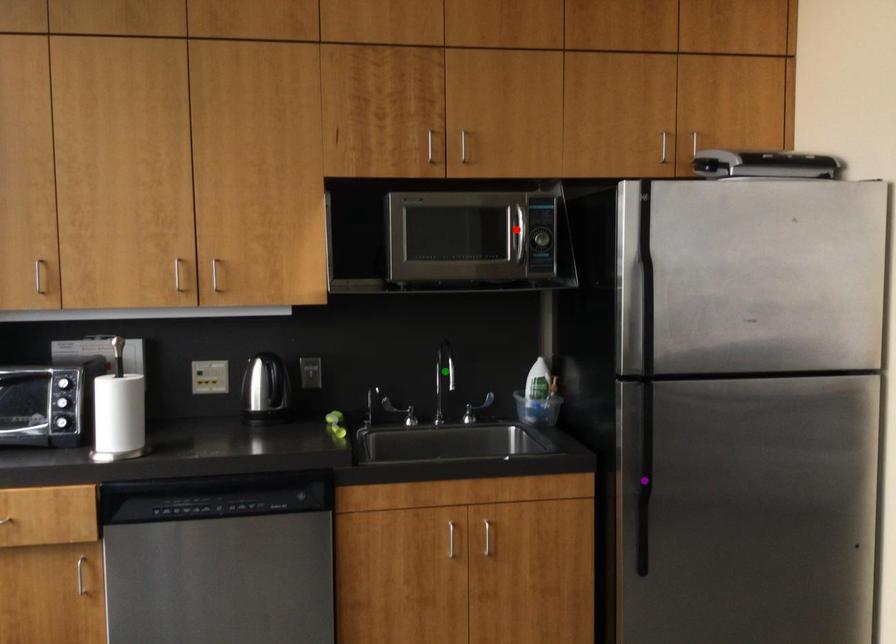
Order these from nearest to farthest:
red point, purple point, green point

green point, red point, purple point